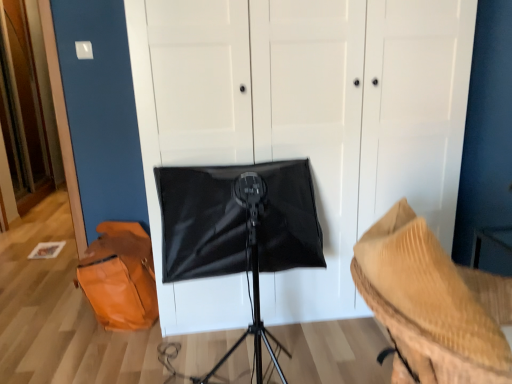
Find the location of a particular element. This screenshot has height=384, width=512. free space to the left of orange leather messenger bag at lower left is located at coordinates coord(36,314).